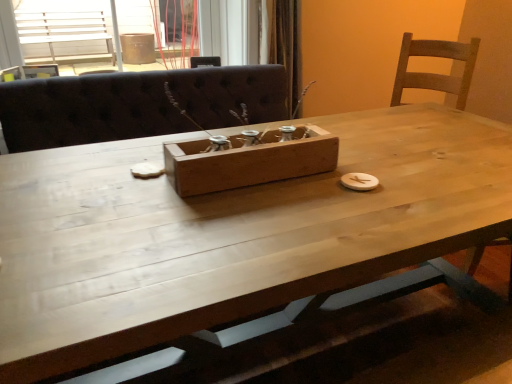
Question: Is wooden frame at upper center directly adjacent to natural wood table at center?

Choices:
 (A) no
 (B) yes

Answer: (A)

Question: From the image's perspective, is wooden frame at upper center beneath natural wood table at center?

Choices:
 (A) yes
 (B) no

Answer: (B)

Question: Is wooden frame at upper center facing towards natural wood table at center?

Choices:
 (A) yes
 (B) no

Answer: (B)

Question: Would you say wooden frame at upper center contains natural wood table at center?

Choices:
 (A) no
 (B) yes

Answer: (A)

Question: Is wooden frame at upper center positioned beyond the bounds of natural wood table at center?

Choices:
 (A) no
 (B) yes

Answer: (B)

Question: Is wooden frame at upper center wider than natural wood table at center?

Choices:
 (A) yes
 (B) no

Answer: (A)

Question: Can you confirm if natural wood table at center is thinner than wooden frame at upper center?

Choices:
 (A) yes
 (B) no

Answer: (A)

Question: Is natural wood table at center bigger than wooden frame at upper center?

Choices:
 (A) no
 (B) yes

Answer: (B)

Question: From a real-world perspective, is natural wood table at center physically above wooden frame at upper center?

Choices:
 (A) no
 (B) yes

Answer: (A)

Question: Is wooden frame at upper center at the back of natural wood table at center?

Choices:
 (A) no
 (B) yes

Answer: (A)

Question: Is natural wood table at center to the left of wooden frame at upper center from the viewer's perspective?

Choices:
 (A) no
 (B) yes

Answer: (A)

Question: Can you confirm if natural wood table at center is shorter than wooden frame at upper center?

Choices:
 (A) no
 (B) yes

Answer: (A)

Question: Is wooden box at center not close to wooden frame at upper center?

Choices:
 (A) no
 (B) yes

Answer: (B)